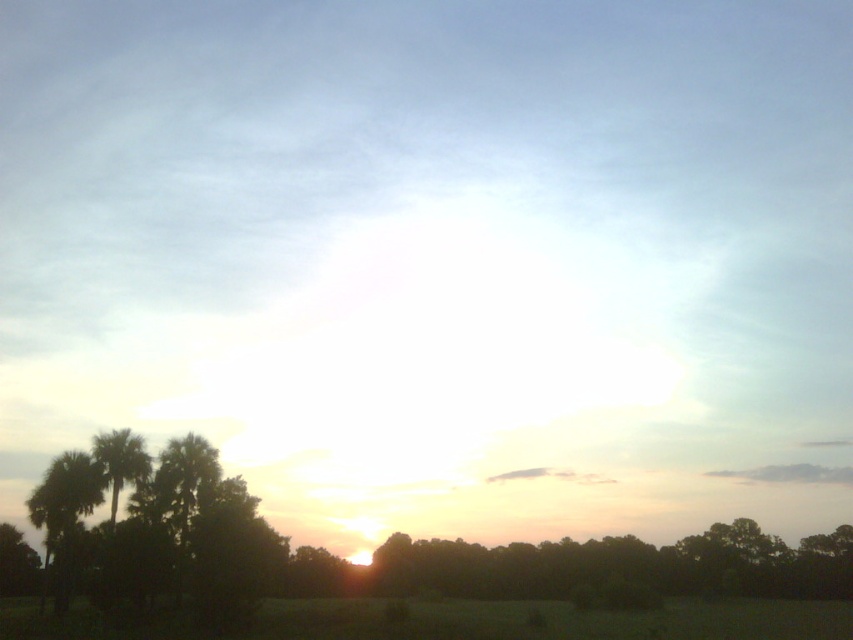
Question: In this image, where is silhouette palm trees at lower left located relative to green grassy field at lower center?

Choices:
 (A) right
 (B) left

Answer: (B)

Question: Does silhouette palm trees at lower left have a greater width compared to green grassy field at lower center?

Choices:
 (A) no
 (B) yes

Answer: (A)

Question: Among these points, which one is nearest to the camera?

Choices:
 (A) (434, 616)
 (B) (178, 516)

Answer: (A)

Question: Which object is closer to the camera taking this photo?

Choices:
 (A) silhouette palm trees at lower left
 (B) green grassy field at lower center

Answer: (B)

Question: Does silhouette palm trees at lower left appear on the right side of green grassy field at lower center?

Choices:
 (A) yes
 (B) no

Answer: (B)

Question: Which object is closer to the camera taking this photo?

Choices:
 (A) green grassy field at lower center
 (B) silhouette palm trees at lower left

Answer: (A)